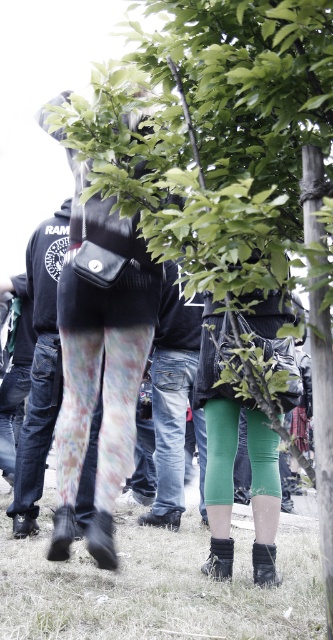
Question: Which point is closer to the camera?

Choices:
 (A) (180, 227)
 (B) (257, 577)
 (C) (41, 289)
 (D) (157, 385)

Answer: (A)

Question: Which is farther from the green grass at lower center?

Choices:
 (A) floral leggings at center
 (B) floral denim leggings at center
 (C) black suede sock at lower center
 (D) green leafy tree at center

Answer: (D)

Question: Is floral-patterned leggings at center above denim jeans at center?

Choices:
 (A) yes
 (B) no

Answer: (A)

Question: Does black suede boot at lower center have a lesser width compared to black suede sock at lower center?

Choices:
 (A) no
 (B) yes

Answer: (A)

Question: Which of the following is the farthest from the observer?

Choices:
 (A) (37, 436)
 (B) (116, 328)
 (C) (163, 397)
 (D) (225, 540)

Answer: (C)

Question: Can you confirm if floral-patterned leggings at center is smaller than floral denim leggings at center?

Choices:
 (A) yes
 (B) no

Answer: (B)